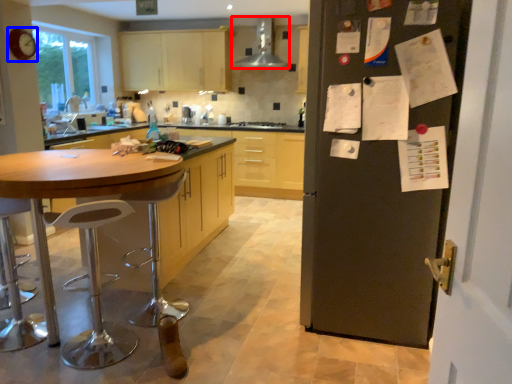
Question: Which object appears farthest to the camera in this image, kitchen appliance (highlighted by a red box) or clock (highlighted by a blue box)?

Choices:
 (A) kitchen appliance
 (B) clock

Answer: (A)